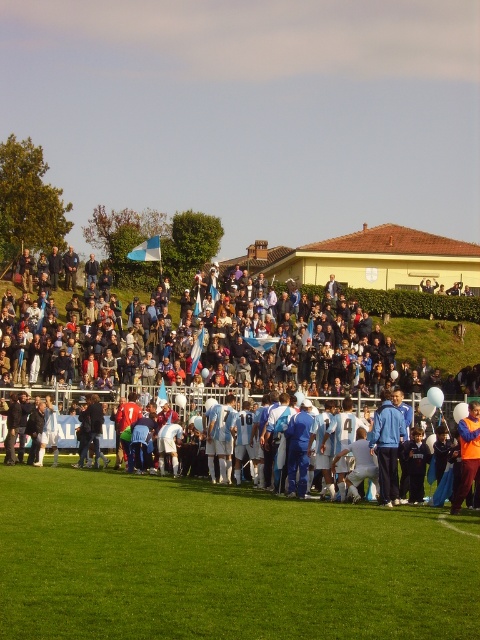
You are a drone operator who needs to capture aerial footage of the soccer match. Your drone has a maximum flight range of 100 feet. If you are standing at the current viewing position, can your drone reach the green grass field at lower center?

The green grass field at lower center is 91.53 feet away from the viewer, which is within the drone operator drone maximum flight range of 100 feet. Yes, the drone can reach the green grass field at lower center.

You are a photographer standing at the edge of the green grass field at lower center and want to capture a photo of the white matte soccer players at center. Since the field is narrower than the players, will you need to adjust your camera angle to fit them all in the frame?

The green grass field at lower center is narrower than the white matte soccer players at center, so you will need to adjust your camera angle to ensure all players are in the frame.

You are a photographer standing at point [225,563]. You want to capture a photo of the green grass field at lower center. Is the point you are standing at the correct location to take the photo?

Yes, because the green grass field at lower center is located at point [225,563].